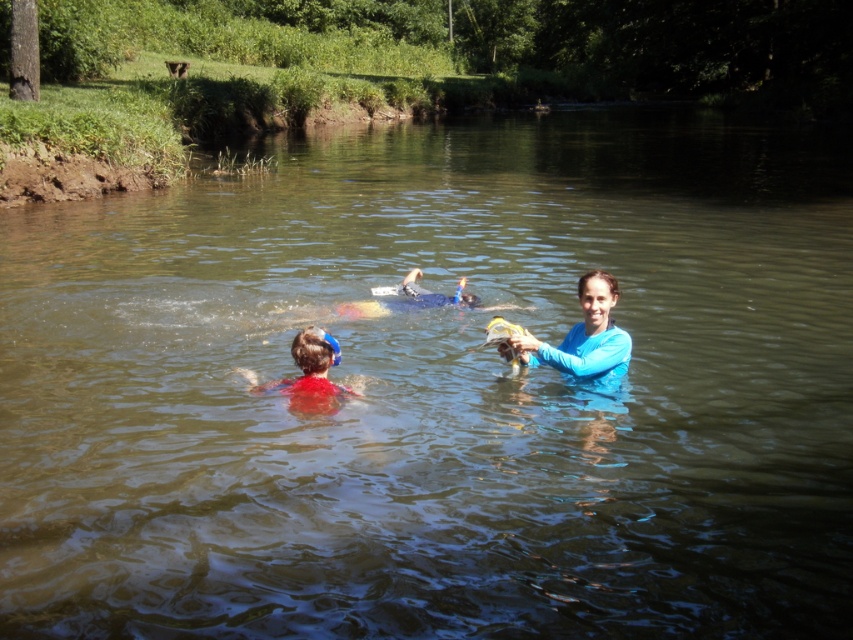
Looking at this image, you are standing at the edge of the water in the serene outdoor scene. There is a point marked at coordinates point (570, 348). Can you reach that point without getting wet?

The point (570, 348) is 23.79 feet away from you, so you can reach it without getting wet since it is far from the water.